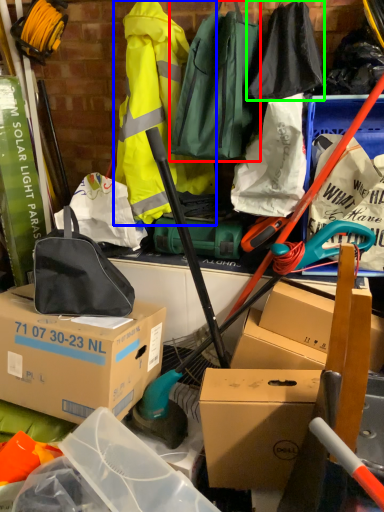
Question: Based on their relative distances, which object is nearer to luggage and bags (highlighted by a red box)? Choose from clothing (highlighted by a blue box) and clothing (highlighted by a green box).

Choices:
 (A) clothing
 (B) clothing

Answer: (B)